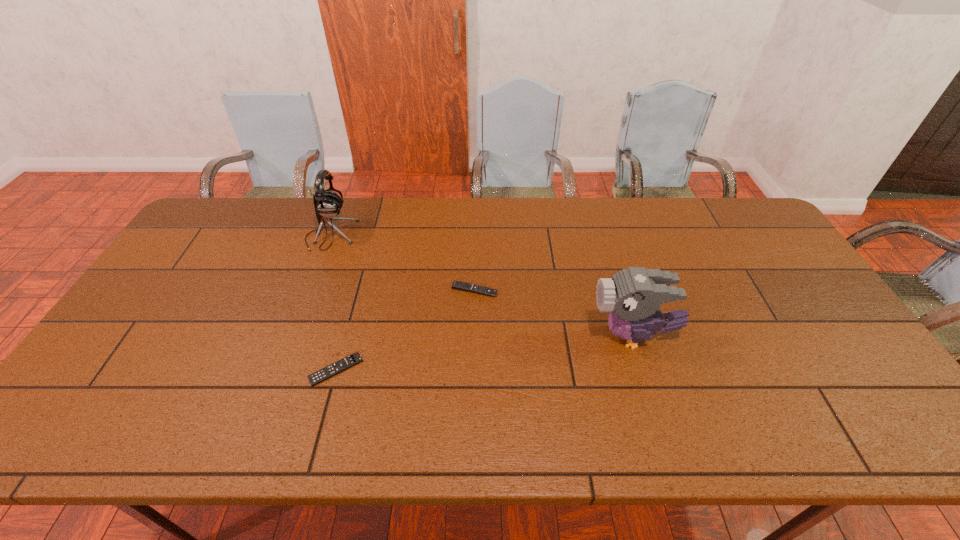
At what (x,y) coordinates should I click in order to perform the action: click on the farthest object. Please return your answer as a coordinate pair (x, y). Looking at the image, I should click on (328, 204).

This screenshot has height=540, width=960. Identify the location of bird. (634, 296).

Identify the location of the rightmost object. (634, 296).

What are the coordinates of `the second shortest object` in the screenshot? It's located at (458, 285).

Locate an element on the screen. This screenshot has width=960, height=540. the right remote control is located at coordinates (458, 285).

This screenshot has width=960, height=540. What are the coordinates of `the shortest object` in the screenshot? It's located at (331, 370).

This screenshot has width=960, height=540. Identify the location of the shorter remote control. (331, 370).

The height and width of the screenshot is (540, 960). I want to click on free space located on the right of the farthest object, so click(473, 235).

This screenshot has height=540, width=960. I want to click on free space located 0.180m at the beak of the rightmost object, so click(x=521, y=336).

Where is `vacant space positioned 0.170m at the beak of the rightmost object`? The image size is (960, 540). vacant space positioned 0.170m at the beak of the rightmost object is located at coordinates (525, 336).